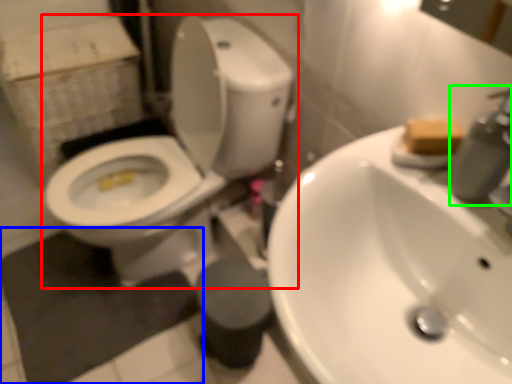
Question: Which object is positioned farthest from toilet (highlighted by a red box)? Select from bath mat (highlighted by a blue box) and plumbing fixture (highlighted by a green box).

Choices:
 (A) bath mat
 (B) plumbing fixture

Answer: (B)